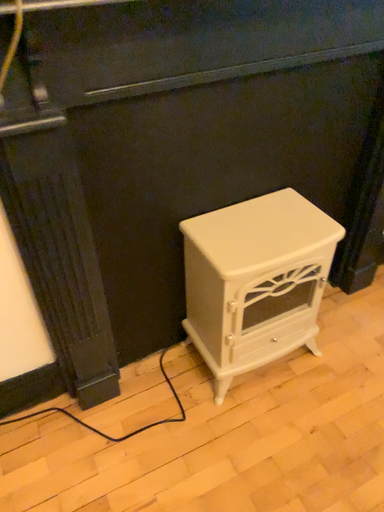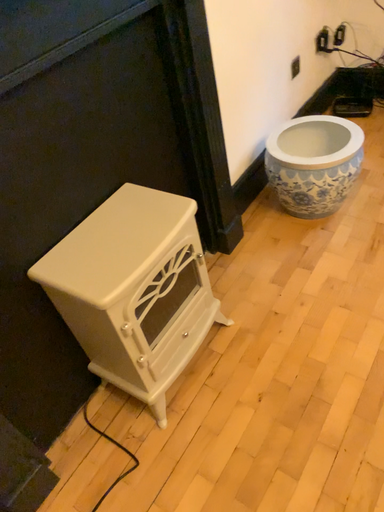
Question: How did the camera likely rotate when shooting the video?

Choices:
 (A) rotated right
 (B) rotated left

Answer: (A)